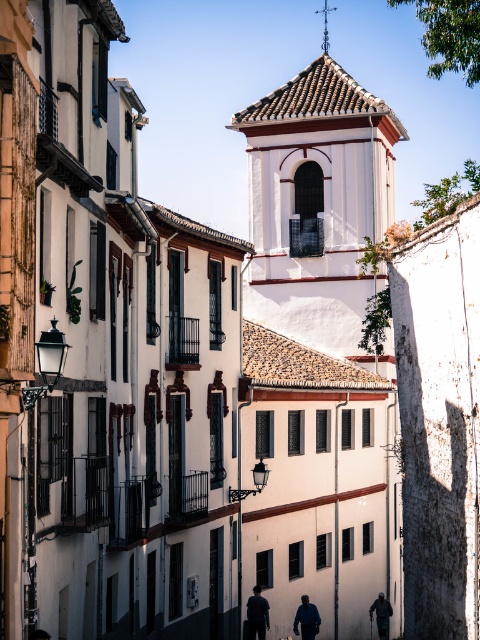
You are a tourist standing at the edge of the street. You see the white textured tower at center and the dark gray fabric jacket at lower right. Which object is positioned to the right side of the street?

The dark gray fabric jacket at lower right is positioned to the right side of the street because the white textured tower at center is to the left of it.

You are a tourist visiting the historic Spanish town and see the dark blue fabric at center and the dark blue jacket at center. Which one is higher up in the scene?

The dark blue fabric at center is located above the dark blue jacket at center, so it is higher up in the scene.

You are a tourist standing in the historic Spanish town and want to take a photo of the dark blue fabric at center. Considering the distance between you and the fabric, can you capture it clearly with your standard smartphone camera?

The dark blue fabric at center is 201.82 feet away from the camera. A standard smartphone camera typically struggles to capture clear details at such a distance, so it might appear blurry or pixelated.